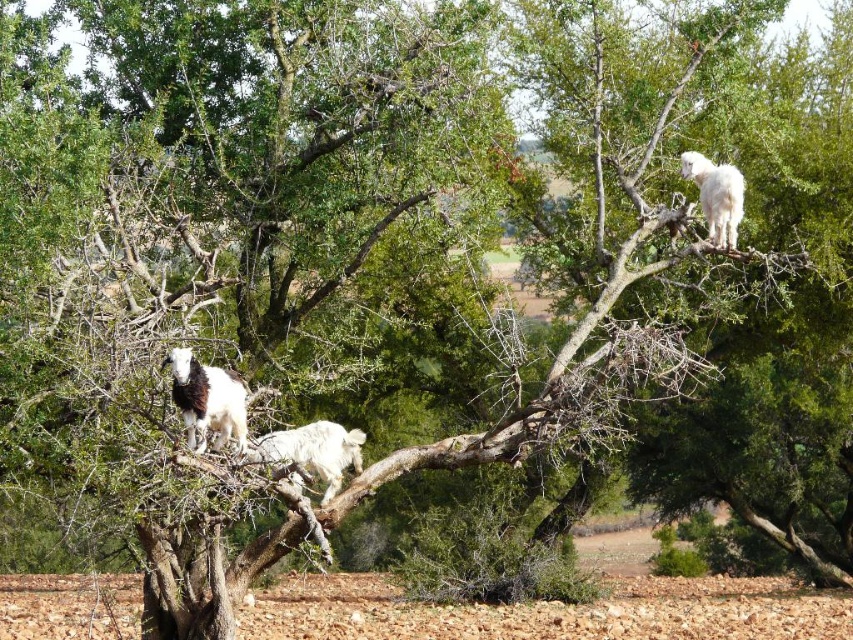
Question: Based on their relative distances, which object is nearer to the white woolen goat at left?

Choices:
 (A) white woolen sheep at center
 (B) dirt field at lower center

Answer: (A)

Question: Considering the real-world distances, which object is closest to the white woolen goat at left?

Choices:
 (A) white woolen sheep at center
 (B) white woolen goat at upper right

Answer: (A)

Question: Where is dirt field at lower center located in relation to white woolen goat at upper right in the image?

Choices:
 (A) above
 (B) below

Answer: (B)

Question: Observing the image, what is the correct spatial positioning of white woolen goat at left in reference to white woolen sheep at center?

Choices:
 (A) left
 (B) right

Answer: (A)

Question: Considering the relative positions of dirt field at lower center and white woolen sheep at center in the image provided, where is dirt field at lower center located with respect to white woolen sheep at center?

Choices:
 (A) below
 (B) above

Answer: (A)

Question: Which point is farther to the camera?

Choices:
 (A) white woolen goat at upper right
 (B) white woolen sheep at center

Answer: (A)